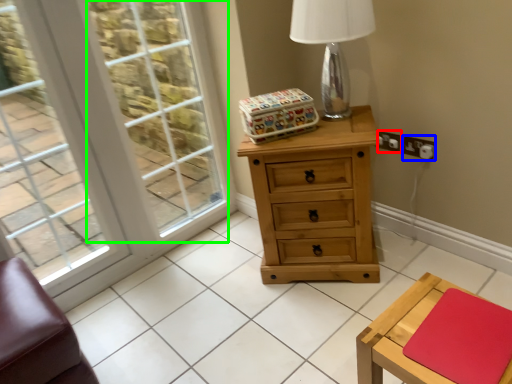
Question: Based on their relative distances, which object is nearer to electric outlet (highlighted by a red box)? Choose from electric outlet (highlighted by a blue box) and window screen (highlighted by a green box).

Choices:
 (A) electric outlet
 (B) window screen

Answer: (A)